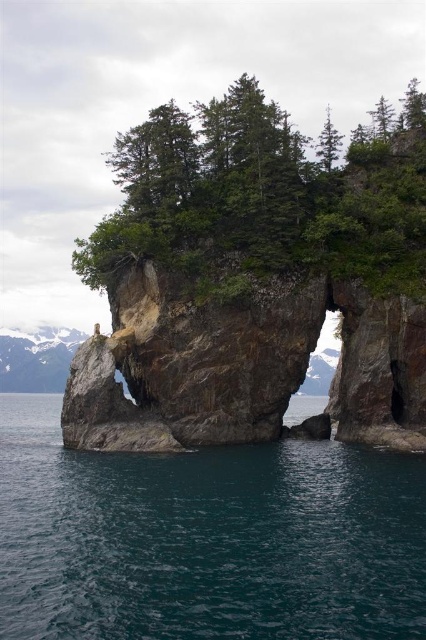
You are standing at the edge of the water looking at the rock formation. There are two points marked on the rock surface. One is at coordinate point (117, 481) and the other is at point (400, 118). Which of these two points is nearer to your viewpoint?

Point (117, 481) is closer to the camera than point (400, 118), so the point at coordinate (117, 481) is nearer to your viewpoint.

You are standing on the shore of the lake and want to reach the teal glossy water at center. Which direction should you move in to get there?

The teal glossy water at center is located at point coordinates, so you should move towards the center of the image to reach it.

You are a landscape photographer planning to capture the rough stone arch at center and the green matte tree at upper center in a single frame. Based on their sizes, which object will appear smaller in the photo?

→ The rough stone arch at center will appear smaller in the photo because it occupies less space than the green matte tree at upper center.